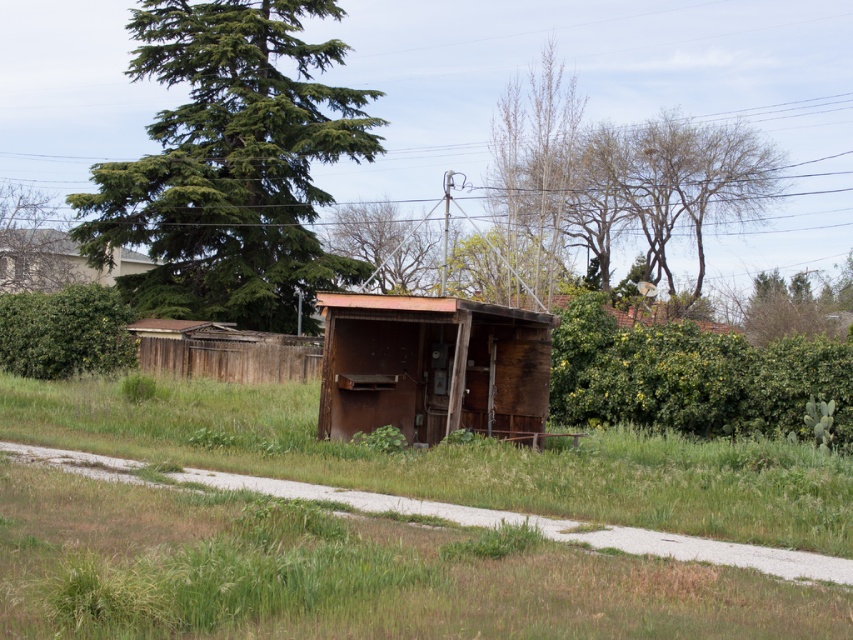
You are standing in the rural area and want to reach the wooden hut at center. There is a bare wood tree at upper right blocking your path. Can you walk around it to the left?

The bare wood tree at upper right is to the right of wooden hut at center, so you can walk around it to the left to reach the wooden hut at center.